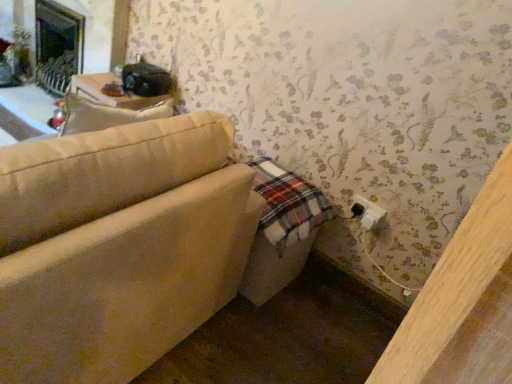
Question: From the image's perspective, is beige fabric couch at lower left above or below white plastic electric outlet at lower right?

Choices:
 (A) above
 (B) below

Answer: (A)

Question: Considering the positions of beige fabric couch at lower left and white plastic electric outlet at lower right in the image, is beige fabric couch at lower left taller or shorter than white plastic electric outlet at lower right?

Choices:
 (A) short
 (B) tall

Answer: (B)

Question: Would you say beige fabric couch at lower left is inside or outside white plastic electric outlet at lower right?

Choices:
 (A) outside
 (B) inside

Answer: (A)

Question: From a real-world perspective, is white plastic electric outlet at lower right physically located above or below beige fabric couch at lower left?

Choices:
 (A) above
 (B) below

Answer: (A)

Question: Is white plastic electric outlet at lower right bigger or smaller than beige fabric couch at lower left?

Choices:
 (A) big
 (B) small

Answer: (B)

Question: Looking at their shapes, would you say white plastic electric outlet at lower right is wider or thinner than beige fabric couch at lower left?

Choices:
 (A) thin
 (B) wide

Answer: (A)

Question: Is white plastic electric outlet at lower right situated inside beige fabric couch at lower left or outside?

Choices:
 (A) outside
 (B) inside

Answer: (A)